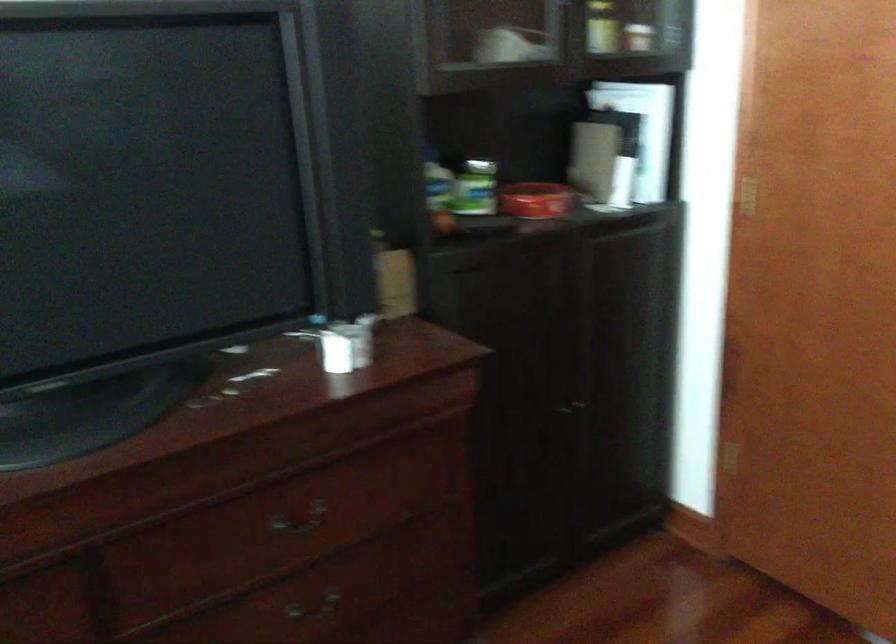
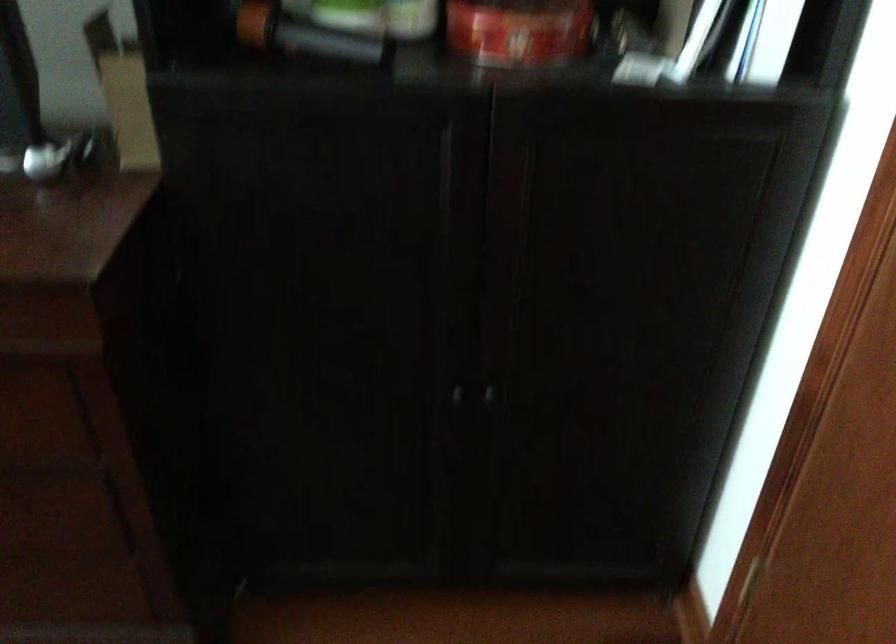
Question: I am providing you with two images of the same scene from different viewpoints. Which of the following objects are not visible in image2?

Choices:
 (A) dark cabinet knob
 (B) red metal can
 (C) black and orange flashlight
 (D) none of these

Answer: (D)